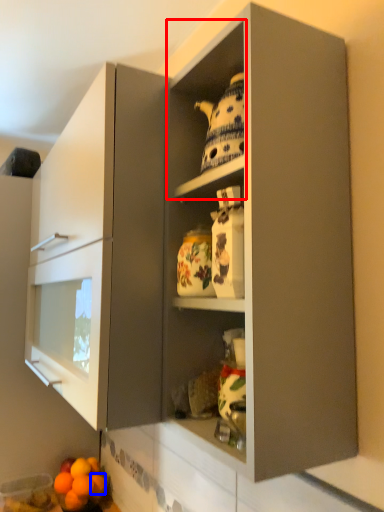
Question: Which of the following is the farthest to the observer, cabinet (highlighted by a red box) or orange (highlighted by a blue box)?

Choices:
 (A) cabinet
 (B) orange

Answer: (B)